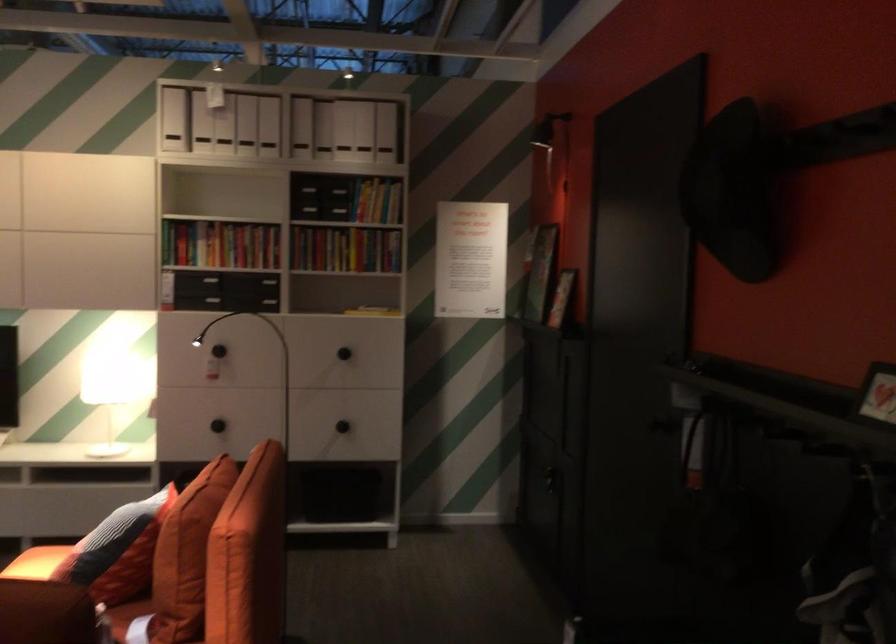
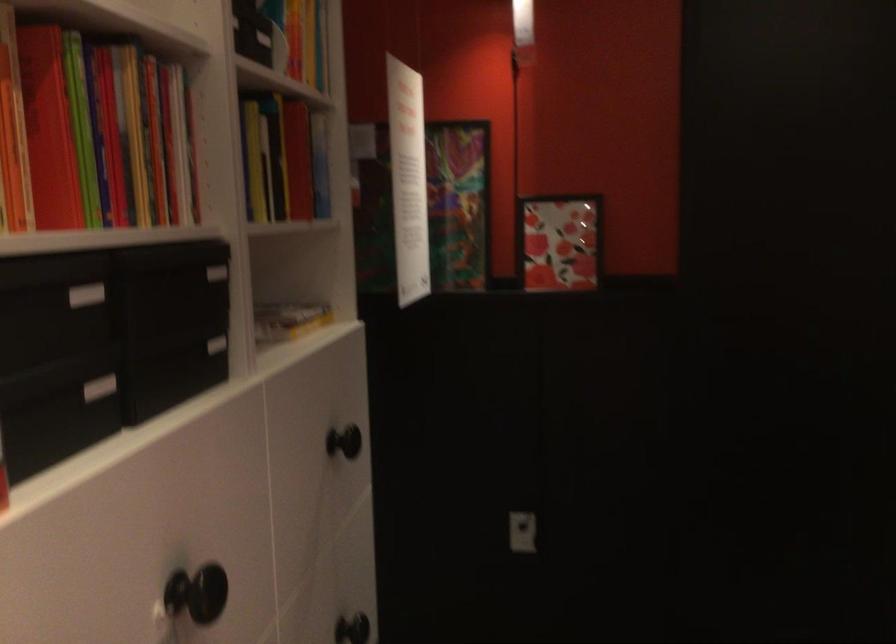
In the second image, find the point that corresponds to (x=255, y=290) in the first image.

(216, 345)